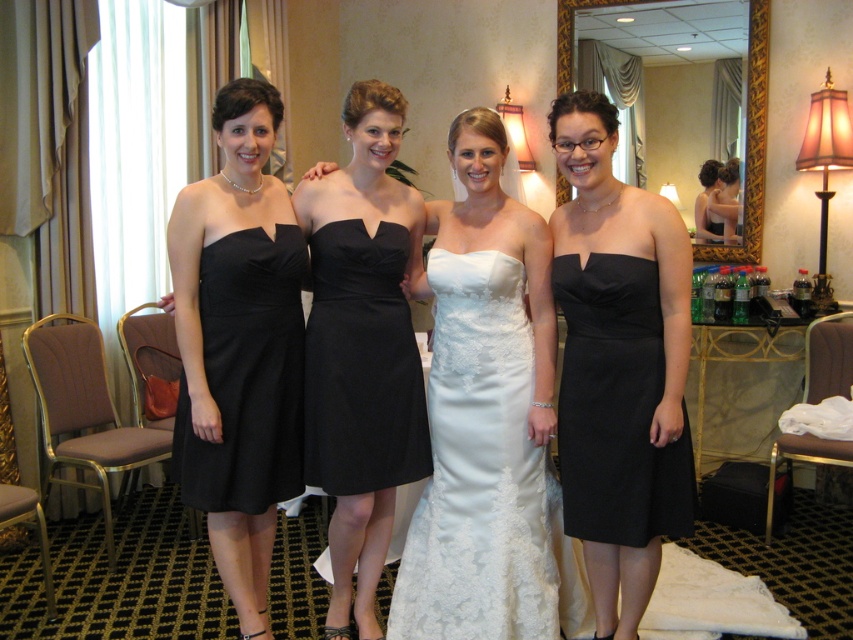
Based on the coordinates provided, which object is located at point [485,476] in the scene?

The point [485,476] corresponds to the white satin dress at center.

You are a photographer setting up for a group photo. You need to adjust the lighting so that both the matte black dress at center and the black satin dress at center are equally visible. Which dress requires more light to be shone on it?

The matte black dress at center is below the black satin dress at center. Since matte surfaces generally require more light to appear as bright as shiny surfaces, you should direct more light towards the matte black dress at center to ensure both are equally visible.

Based on the photo, you are a photographer adjusting your camera to capture the group photo. You want to ensure both the white satin dress at center and the black satin dress at left are fully visible in the frame. Based on their positions, which dress might be partially obscured and why?

The black satin dress at left is behind the white satin dress at center, so it might be partially obscured because it is positioned behind the other dress.